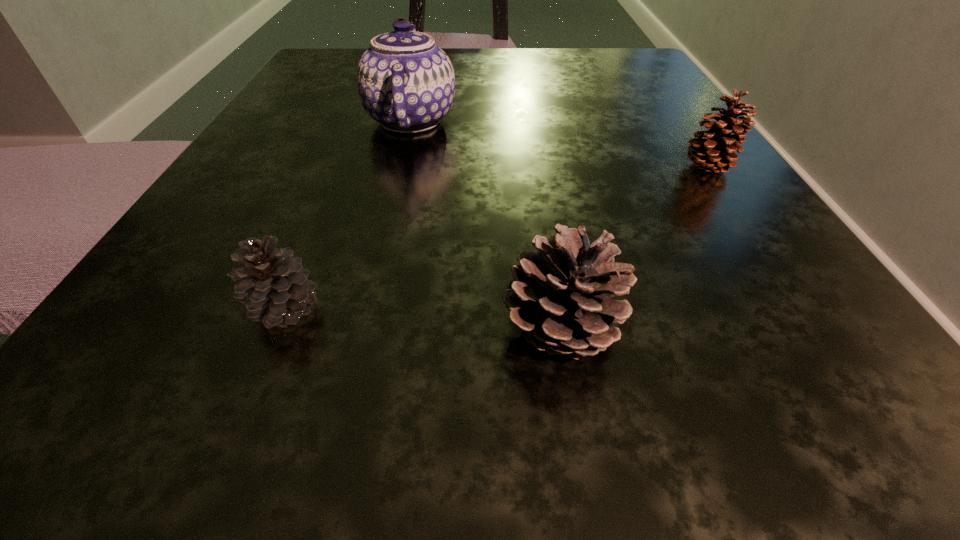
Where is `vacant space in between the chinaware and the farthest pinecone`? This screenshot has width=960, height=540. vacant space in between the chinaware and the farthest pinecone is located at coordinates (559, 144).

Identify which object is located as the second nearest to the farthest pinecone. Please provide its 2D coordinates. Your answer should be formatted as a tuple, i.e. [(x, y)], where the tuple contains the x and y coordinates of a point satisfying the conditions above.

[(406, 83)]

Locate an element on the screen. object that stands as the closest to the shortest pinecone is located at coordinates (561, 296).

This screenshot has width=960, height=540. In order to click on pinecone that is the second closest to the tallest object in this screenshot , I will do `click(561, 296)`.

Select which pinecone appears as the second closest to the third object from left to right. Please provide its 2D coordinates. Your answer should be formatted as a tuple, i.e. [(x, y)], where the tuple contains the x and y coordinates of a point satisfying the conditions above.

[(717, 153)]

At what (x,y) coordinates should I click in order to perform the action: click on blank space that satisfies the following two spatial constraints: 1. on the back side of the rightmost object; 2. on the right side of the third object from left to right. Please return your answer as a coordinate pair (x, y). The image size is (960, 540). Looking at the image, I should click on (534, 168).

Identify the location of blank area in the image that satisfies the following two spatial constraints: 1. on the back side of the farthest pinecone; 2. at the spout of the tallest object. This screenshot has width=960, height=540. (675, 121).

Identify the location of free location that satisfies the following two spatial constraints: 1. on the back side of the second pinecone from right to left; 2. at the spout of the chinaware. (526, 121).

Where is `free space that satisfies the following two spatial constraints: 1. at the spout of the second pinecone from left to right; 2. on the left side of the tallest object`? free space that satisfies the following two spatial constraints: 1. at the spout of the second pinecone from left to right; 2. on the left side of the tallest object is located at coordinates (361, 330).

I want to click on blank area in the image that satisfies the following two spatial constraints: 1. on the back side of the rightmost pinecone; 2. on the right side of the shortest object, so click(x=344, y=168).